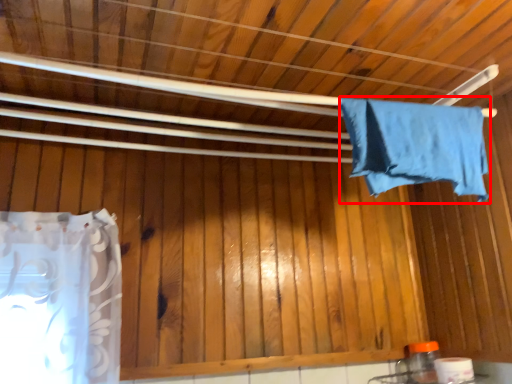
Question: From the image, what is the correct spatial relationship of towel (annotated by the red box) in relation to toilet paper?

Choices:
 (A) right
 (B) left

Answer: (B)